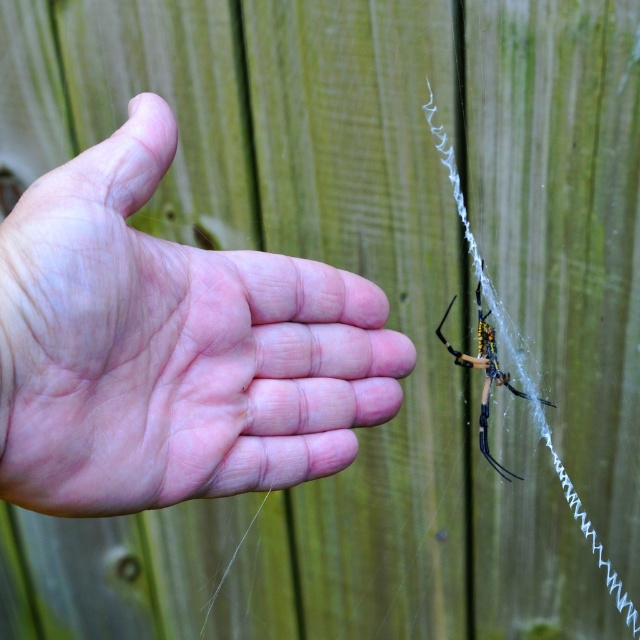
You are a drone operator trying to capture a close shot of the spider on the web. You have two points marked as reference points for your camera focus. The first point is at coordinate point[332,435] and the second is at point[460,362]. Which point should you focus on to ensure the spider is in focus?

You should focus on point[332,435] because it is in front of point[460,362], making it closer to the camera and thus better for focusing on the spider.

You are a photographer trying to capture a close shot of the yellow fuzzy spider at center. However, your camera lens is currently focused on the pink flesh at center. What adjustment should you make to focus on the spider?

Since the pink flesh at center is closer to the viewer than the yellow fuzzy spider at center, you need to adjust the focus to move it further away from the current position to capture the spider clearly.

You are a robotic arm trying to pick up the yellow fuzzy spider at center without touching the pink flesh at center. Can you do it?

The pink flesh at center might be wider than yellow fuzzy spider at center, so there is a possibility that the robotic arm can maneuver around the pink flesh at center to pick up the yellow fuzzy spider at center without contact.